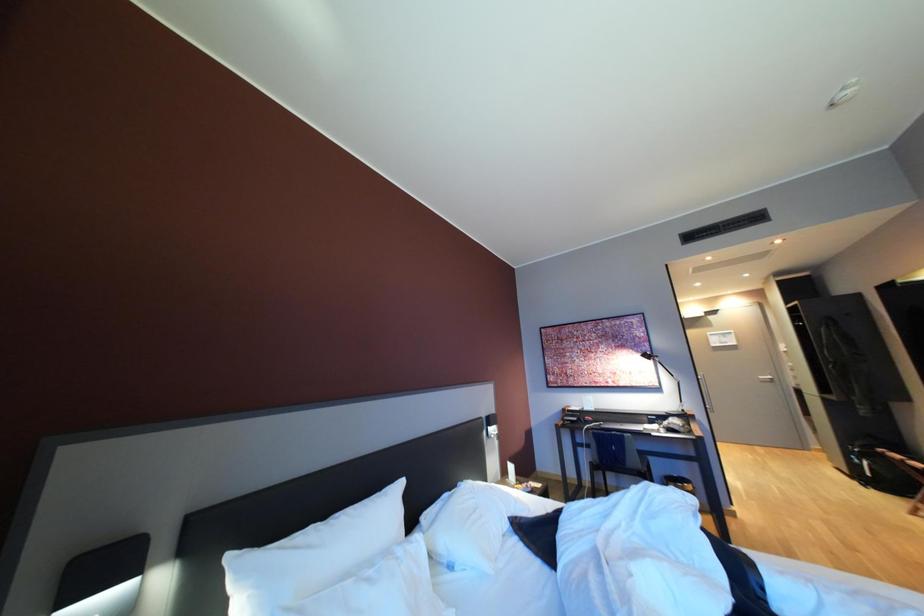
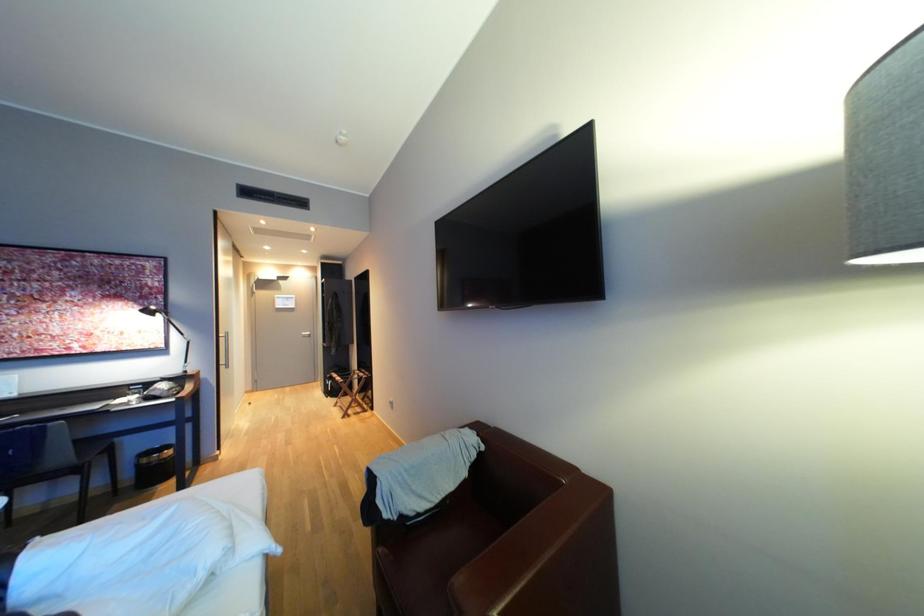
Question: The camera is either moving clockwise (left) or counter-clockwise (right) around the object. The first image is from the beginning of the video and the second image is from the end. Is the camera moving left or right when shooting the video?

Choices:
 (A) Left
 (B) Right

Answer: (A)